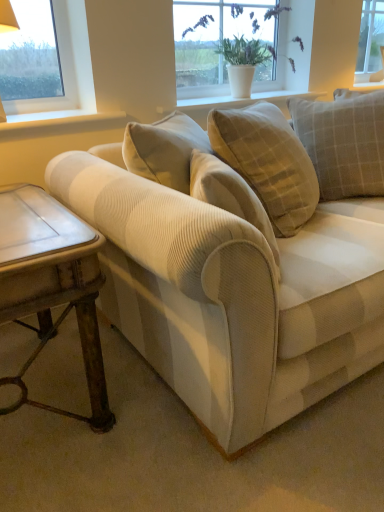
Question: Considering the relative sizes of light beige corduroy pillow at upper right, which is the 1th pillow from right to left, and white wood at upper center, the first window sill when ordered from left to right, in the image provided, is light beige corduroy pillow at upper right, which is the 1th pillow from right to left, shorter than white wood at upper center, the first window sill when ordered from left to right,?

Choices:
 (A) no
 (B) yes

Answer: (A)

Question: Considering the relative sizes of light beige corduroy pillow at upper right, which is the 1th pillow from right to left, and white wood at upper center, positioned as the 1th window sill in bottom-to-top order, in the image provided, is light beige corduroy pillow at upper right, which is the 1th pillow from right to left, smaller than white wood at upper center, positioned as the 1th window sill in bottom-to-top order,?

Choices:
 (A) no
 (B) yes

Answer: (A)

Question: Does light beige corduroy pillow at upper right, which is the 1th pillow from right to left, contain white wood at upper center, the second window sill when ordered from top to bottom?

Choices:
 (A) yes
 (B) no

Answer: (B)

Question: Is light beige corduroy pillow at upper right, the 2th pillow viewed from the left, positioned behind white wood at upper center, which appears as the 2th window sill when viewed from the right?

Choices:
 (A) no
 (B) yes

Answer: (B)

Question: Is light beige corduroy pillow at upper right, which is the 1th pillow from right to left, next to white wood at upper center, positioned as the 1th window sill in bottom-to-top order?

Choices:
 (A) no
 (B) yes

Answer: (A)

Question: Is light beige corduroy pillow at upper right, which is the 1th pillow from right to left, to the left of white wood at upper center, the second window sill when ordered from top to bottom, from the viewer's perspective?

Choices:
 (A) yes
 (B) no

Answer: (B)

Question: Would you say white textured vase at upper center, positioned as the 2th window sill in front-to-back order, is a long distance from white wood at upper center, which appears as the 2th window sill when viewed from the right?

Choices:
 (A) no
 (B) yes

Answer: (A)

Question: Is white textured vase at upper center, which is the first window sill in right-to-left order, oriented towards white wood at upper center, the second window sill in the back-to-front sequence?

Choices:
 (A) no
 (B) yes

Answer: (A)

Question: Is white textured vase at upper center, positioned as the first window sill in back-to-front order, at the left side of white wood at upper center, the first window sill when ordered from left to right?

Choices:
 (A) yes
 (B) no

Answer: (B)

Question: Does white textured vase at upper center, positioned as the first window sill in back-to-front order, have a smaller size compared to white wood at upper center, which appears as the 2th window sill when viewed from the right?

Choices:
 (A) yes
 (B) no

Answer: (B)

Question: From a real-world perspective, is white textured vase at upper center, positioned as the 2th window sill in front-to-back order, on white wood at upper center, the second window sill when ordered from top to bottom?

Choices:
 (A) no
 (B) yes

Answer: (B)

Question: Does white textured vase at upper center, arranged as the 1th window sill when viewed from the top, have a lesser width compared to white wood at upper center, which is the 1th window sill from front to back?

Choices:
 (A) yes
 (B) no

Answer: (A)

Question: Is rustic wood side table at lower left shorter than light beige corduroy pillow at upper right, the 2th pillow viewed from the left?

Choices:
 (A) yes
 (B) no

Answer: (A)